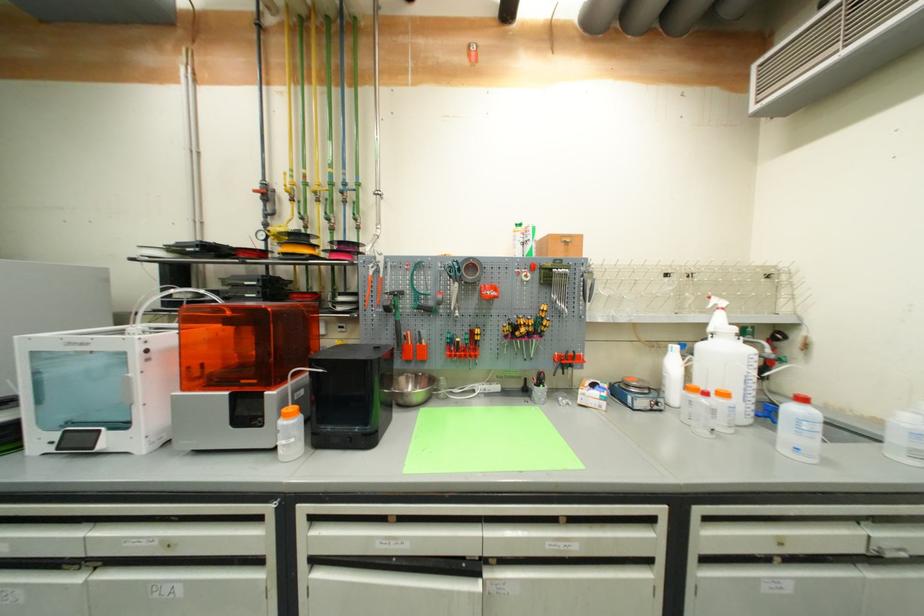
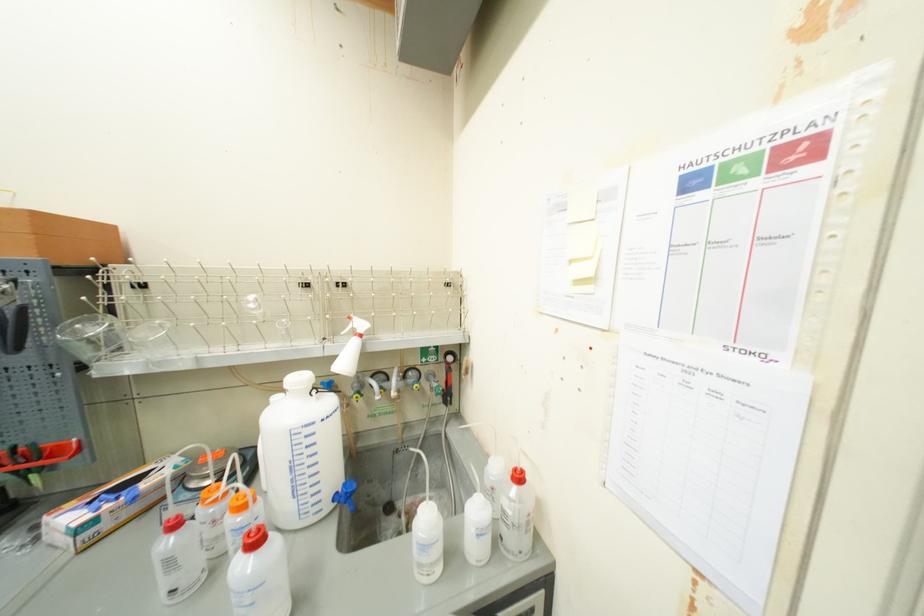
Locate, in the second image, the point that corresponds to pixel 745 341 in the first image.

(317, 398)